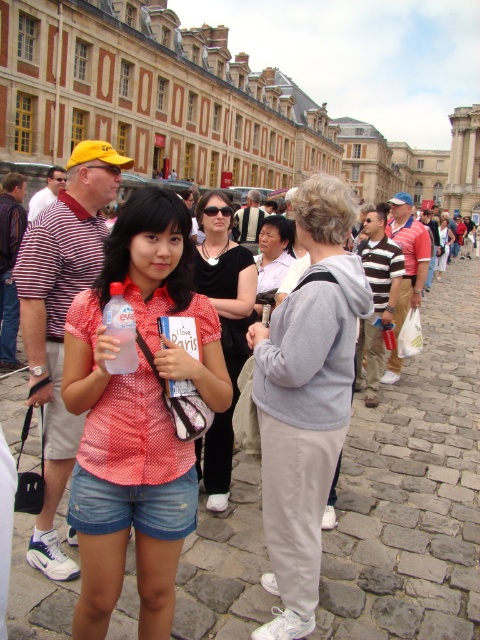
Question: Which point is closer to the camera?

Choices:
 (A) (96, 328)
 (B) (240, 284)
 (C) (300, 410)
 (D) (127, 358)

Answer: (D)

Question: Which object is the farthest from the polka dot fabric shirt at center?

Choices:
 (A) light gray sweatshirt at center
 (B) transparent plastic bottle at center

Answer: (A)

Question: Estimate the real-world distances between objects in this image. Which object is farther from the matte black shirt at center?

Choices:
 (A) light gray sweatshirt at center
 (B) polka dot fabric shirt at center

Answer: (B)

Question: Does polka dot fabric shirt at center appear on the right side of matte black shirt at center?

Choices:
 (A) no
 (B) yes

Answer: (A)

Question: Can you confirm if polka dot fabric shirt at center is smaller than matte black shirt at center?

Choices:
 (A) no
 (B) yes

Answer: (A)

Question: Is polka dot fabric shirt at center bigger than light gray sweatshirt at center?

Choices:
 (A) no
 (B) yes

Answer: (A)